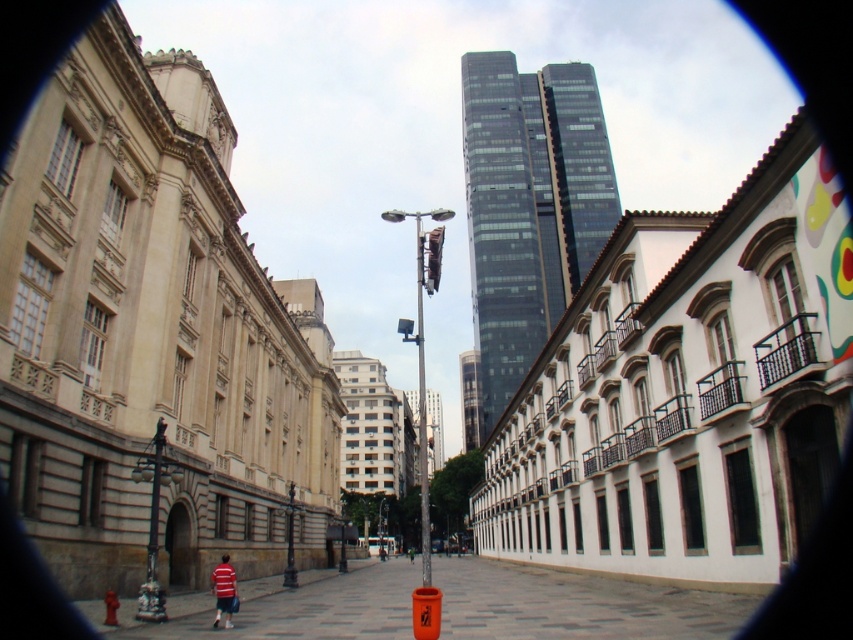
Does striped cotton shirt at lower left appear over orange plastic traffic cone at center?

No.

Does striped cotton shirt at lower left have a larger size compared to orange plastic traffic cone at center?

Indeed, striped cotton shirt at lower left has a larger size compared to orange plastic traffic cone at center.

This screenshot has height=640, width=853. I want to click on striped cotton shirt at lower left, so click(x=224, y=589).

Does orange plastic traffic cone at center have a lesser width compared to green fabric jacket at center?

No.

Is orange plastic traffic cone at center positioned at the back of green fabric jacket at center?

That is False.

The width and height of the screenshot is (853, 640). I want to click on orange plastic traffic cone at center, so click(109, 608).

Is point (749, 612) in front of point (409, 554)?

Yes, it is in front of point (409, 554).

Between point (397, 566) and point (409, 547), which one is positioned behind?

Positioned behind is point (409, 547).

Find the location of `polished stone pavement at lower center`. polished stone pavement at lower center is located at coordinates (576, 604).